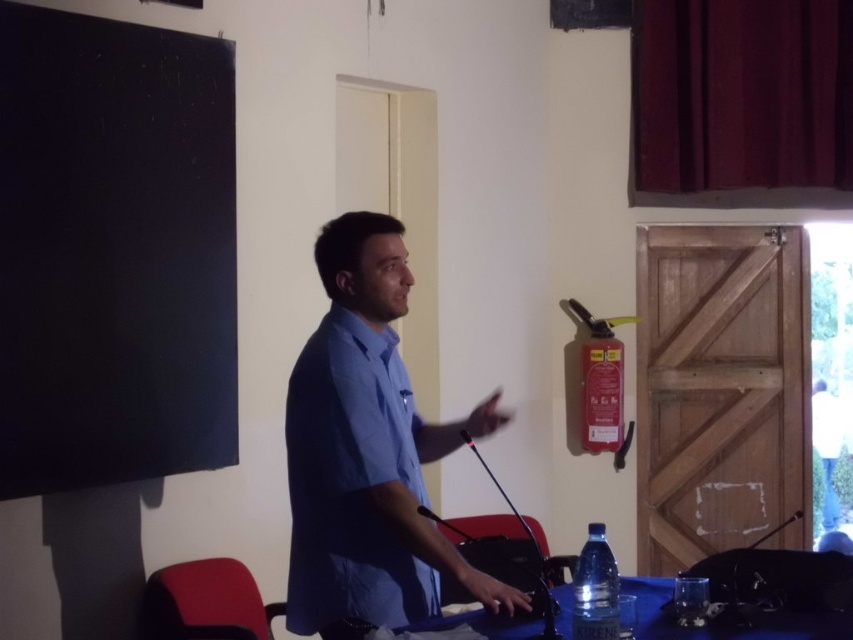
Between black metallic microphone at center and black plastic microphone at lower right, which one appears on the right side from the viewer's perspective?

black plastic microphone at lower right is more to the right.

Does black metallic microphone at center have a greater height compared to black plastic microphone at lower right?

Correct, black metallic microphone at center is much taller as black plastic microphone at lower right.

The width and height of the screenshot is (853, 640). What are the coordinates of `black metallic microphone at center` in the screenshot? It's located at (534, 552).

Find the location of `black metallic microphone at center`. black metallic microphone at center is located at coordinates (534, 552).

Between blue fabric table at lower center and black metallic microphone at center, which one has more height?

With more height is black metallic microphone at center.

Between blue fabric table at lower center and black metallic microphone at center, which one appears on the left side from the viewer's perspective?

Result: black metallic microphone at center

Who is more distant from viewer, [482,618] or [521,520]?

The point [482,618] is behind.

What are the coordinates of `blue fabric table at lower center` in the screenshot? It's located at (743, 614).

Can you confirm if blue cotton shirt at center is positioned to the left of blue fabric table at lower center?

Yes, blue cotton shirt at center is to the left of blue fabric table at lower center.

Which is in front, point (334, 516) or point (848, 625)?

Point (334, 516) is in front.

Find the location of `blue cotton shirt at center`. blue cotton shirt at center is located at coordinates (369, 451).